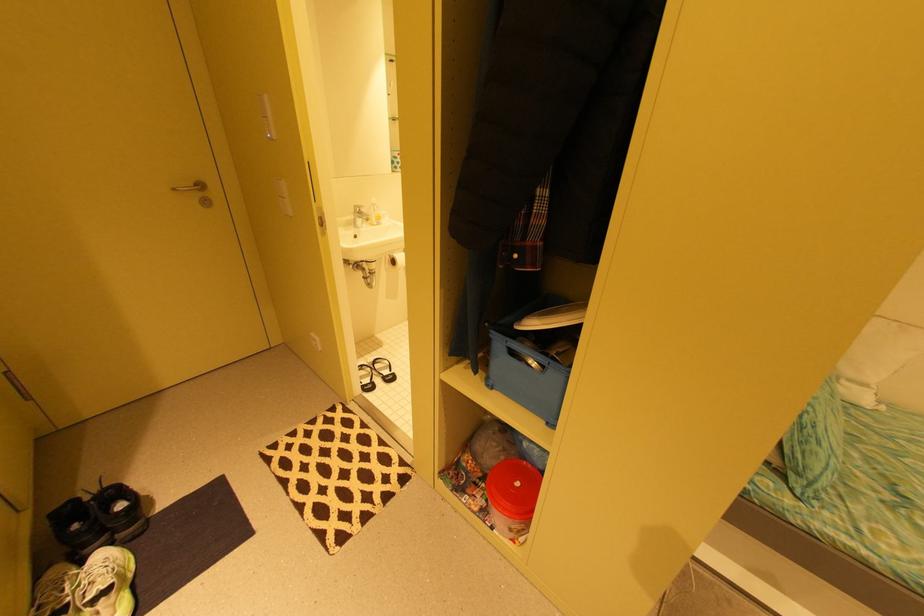
The height and width of the screenshot is (616, 924). What do you see at coordinates (396, 259) in the screenshot? I see `the toilet paper roll` at bounding box center [396, 259].